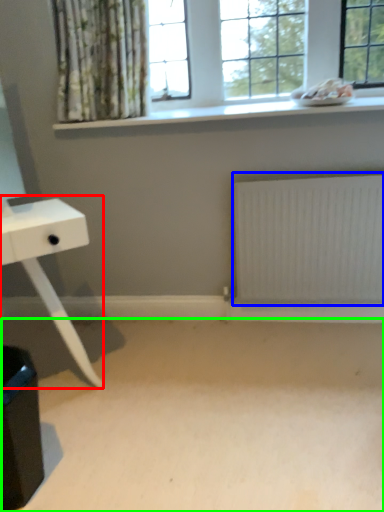
Question: Estimate the real-world distances between objects in this image. Which object is closer to table (highlighted by a red box), radiator (highlighted by a blue box) or plain (highlighted by a green box)?

Choices:
 (A) radiator
 (B) plain

Answer: (B)